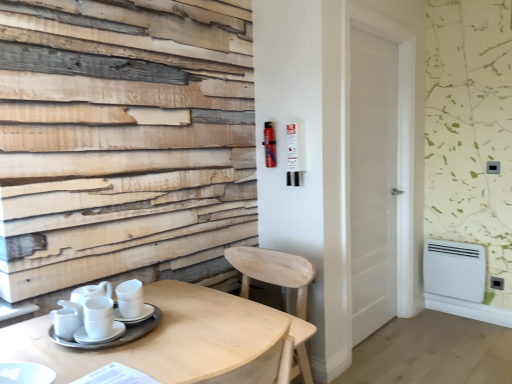
In order to click on vacant space that is to the left of white glossy cups at lower left in this screenshot , I will do `click(22, 335)`.